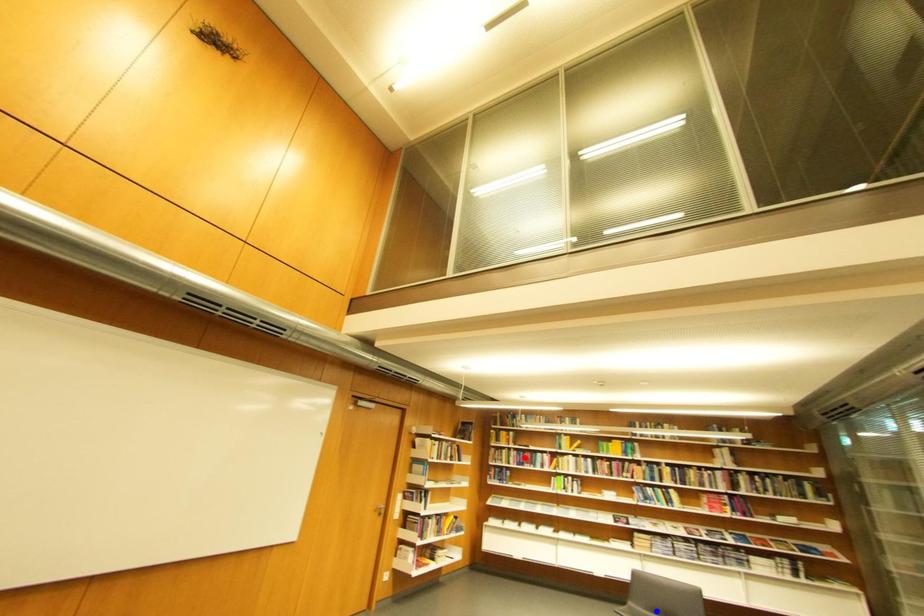
Question: Two points are marked on the image. Which point is closer to the camera?

Choices:
 (A) Blue point is closer.
 (B) Red point is closer.

Answer: (A)